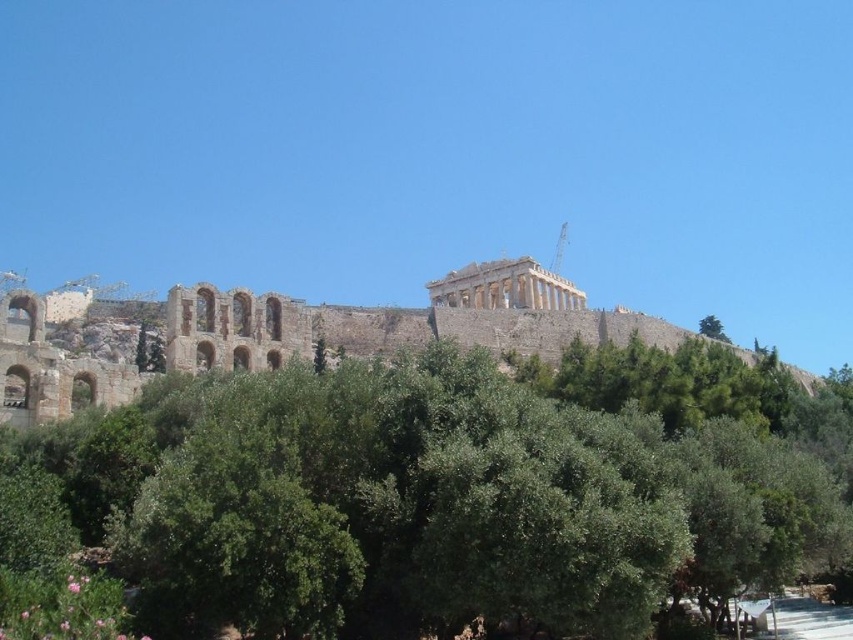
Can you confirm if green leafy tree at center is taller than stone amphitheater at center?

Incorrect, green leafy tree at center's height is not larger of stone amphitheater at center's.

Who is more forward, (363, 496) or (532, 337)?

Positioned in front is point (363, 496).

Which is behind, point (422, 570) or point (544, 344)?

Point (544, 344)

Identify the location of green leafy tree at center. The height and width of the screenshot is (640, 853). (427, 497).

Between green leafy tree at center and green leafy tree at upper center, which one has less height?

green leafy tree at upper center is shorter.

Is green leafy tree at center shorter than green leafy tree at upper center?

In fact, green leafy tree at center may be taller than green leafy tree at upper center.

Does point (692, 552) come in front of point (717, 324)?

Yes.

The image size is (853, 640). I want to click on green leafy tree at center, so click(x=427, y=497).

Looking at this image, does stone amphitheater at center have a lesser width compared to green leafy tree at upper center?

In fact, stone amphitheater at center might be wider than green leafy tree at upper center.

Who is more forward, (134, 378) or (704, 328)?

Point (134, 378) is more forward.

Find the location of `stone amphitheater at center`. stone amphitheater at center is located at coordinates (374, 328).